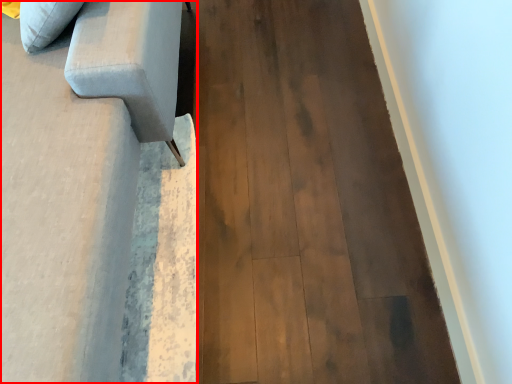
Question: From the image's perspective, what is the correct spatial relationship of furniture (annotated by the red box) in relation to plywood?

Choices:
 (A) above
 (B) below

Answer: (A)